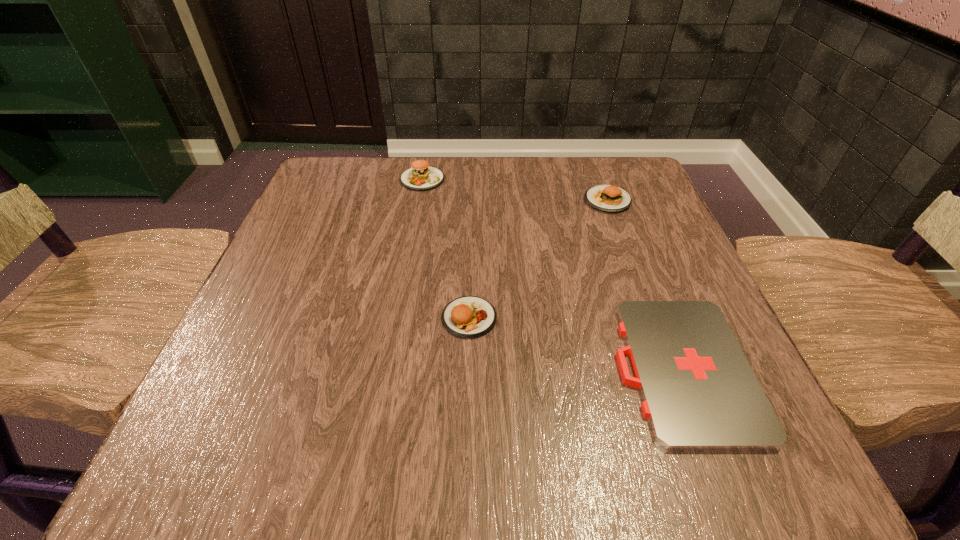
You are a GUI agent. You are given a task and a screenshot of the screen. Output one action in this format:
    pyautogui.click(x=<x>, y=<y>)
    Task: Click on the vacant area that lies between the leftmost patty (food) and the first-aid kit
    
    Given the screenshot: What is the action you would take?
    pyautogui.click(x=552, y=274)

Locate an element on the screen. free space between the shortest object and the second object from left to right is located at coordinates (576, 343).

The width and height of the screenshot is (960, 540). Identify the location of free space between the rightmost patty (food) and the leftmost object. (515, 190).

Identify the location of the closest object to the shortest object. (468, 317).

Locate which object ranks third in proximity to the rightmost patty (food). Please provide its 2D coordinates. Your answer should be formatted as a tuple, i.e. [(x, y)], where the tuple contains the x and y coordinates of a point satisfying the conditions above.

[(468, 317)]

Identify the location of the second closest patty (food) to the leftmost object. (468, 317).

You are a GUI agent. You are given a task and a screenshot of the screen. Output one action in this format:
    pyautogui.click(x=<x>, y=<y>)
    Task: Click on the patty (food) that is the closest to the leftmost object
    This screenshot has height=540, width=960.
    Given the screenshot: What is the action you would take?
    pyautogui.click(x=606, y=198)

Where is `free space that satisfies the following two spatial constraints: 1. on the back side of the shortest patty (food); 2. on the right side of the rightmost patty (food)`? free space that satisfies the following two spatial constraints: 1. on the back side of the shortest patty (food); 2. on the right side of the rightmost patty (food) is located at coordinates (472, 201).